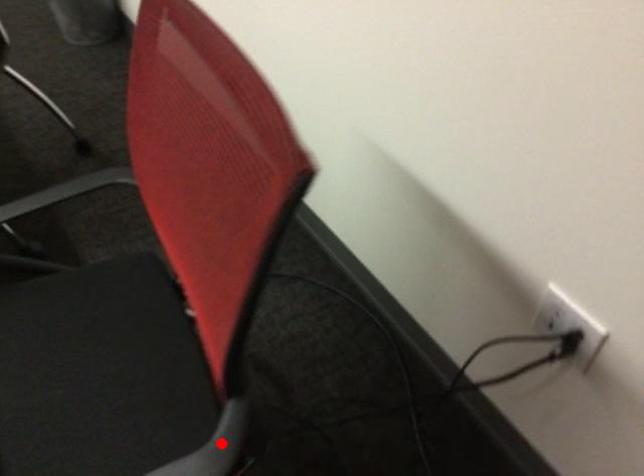
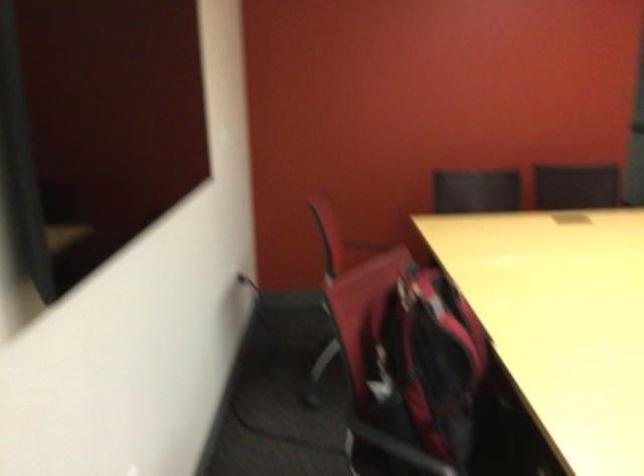
Question: I am providing you with two images of the same scene from different viewpoints. A red point is marked on the first image. Can you still see the location of the red point in image 2?

Choices:
 (A) Yes
 (B) No

Answer: (B)